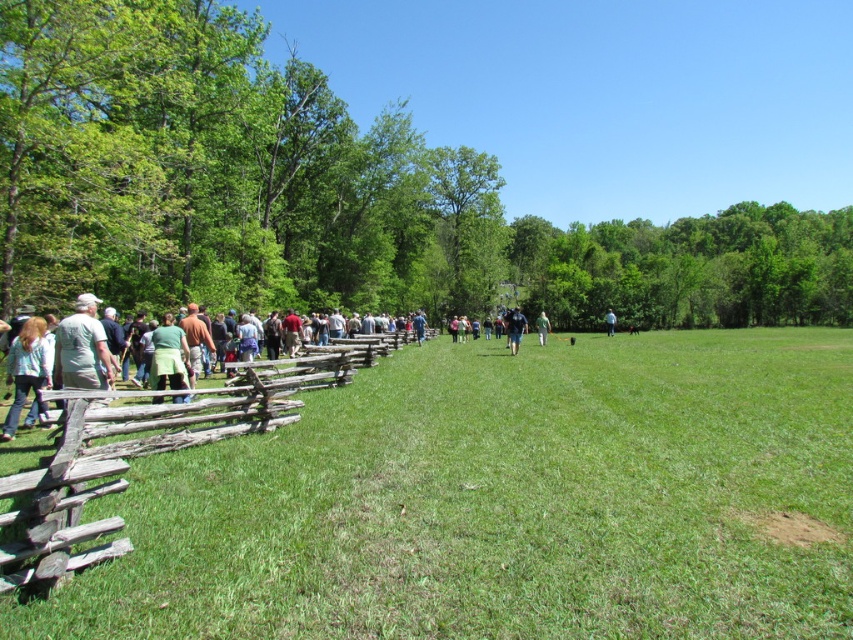
Question: Can you confirm if green grassy field at left is smaller than green fabric shirt at center?

Choices:
 (A) no
 (B) yes

Answer: (B)

Question: Can you confirm if green grassy field at left is positioned above green fabric apron at center?

Choices:
 (A) no
 (B) yes

Answer: (A)

Question: Is light blue shirt at left above green fabric apron at center?

Choices:
 (A) no
 (B) yes

Answer: (A)

Question: Which object is the farthest from the light blue shirt at left?

Choices:
 (A) green fabric apron at center
 (B) weathered wood fence at left
 (C) dark blue fabric at center
 (D) green fabric shirt at center

Answer: (D)

Question: Which point appears closest to the camera in this image?

Choices:
 (A) (613, 317)
 (B) (173, 372)
 (C) (16, 394)

Answer: (C)

Question: Which of the following is the farthest from the observer?

Choices:
 (A) (515, 330)
 (B) (129, 499)

Answer: (A)